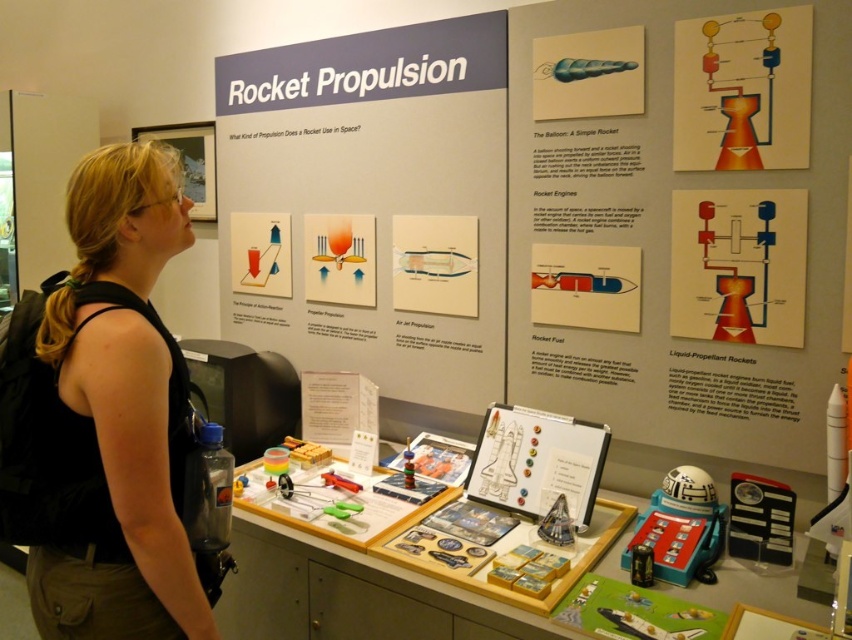
Question: Which object appears farthest from the camera in this image?

Choices:
 (A) white matte rocket at lower right
 (B) matte red rocket engine diagram at center right
 (C) black fabric at left

Answer: (B)

Question: Is matte red rocket engine diagram at center right in front of white matte rocket at lower right?

Choices:
 (A) no
 (B) yes

Answer: (A)

Question: Does matte red rocket engine diagram at center right have a greater width compared to white matte rocket at lower right?

Choices:
 (A) yes
 (B) no

Answer: (A)

Question: Can you confirm if matte red rocket engine diagram at center right is smaller than white matte rocket at lower right?

Choices:
 (A) no
 (B) yes

Answer: (A)

Question: Which point is farther to the camera?

Choices:
 (A) black fabric at left
 (B) matte red rocket engine diagram at center right

Answer: (B)

Question: Estimate the real-world distances between objects in this image. Which object is closer to the matte red rocket engine diagram at center right?

Choices:
 (A) white matte rocket at lower right
 (B) black fabric at left

Answer: (A)